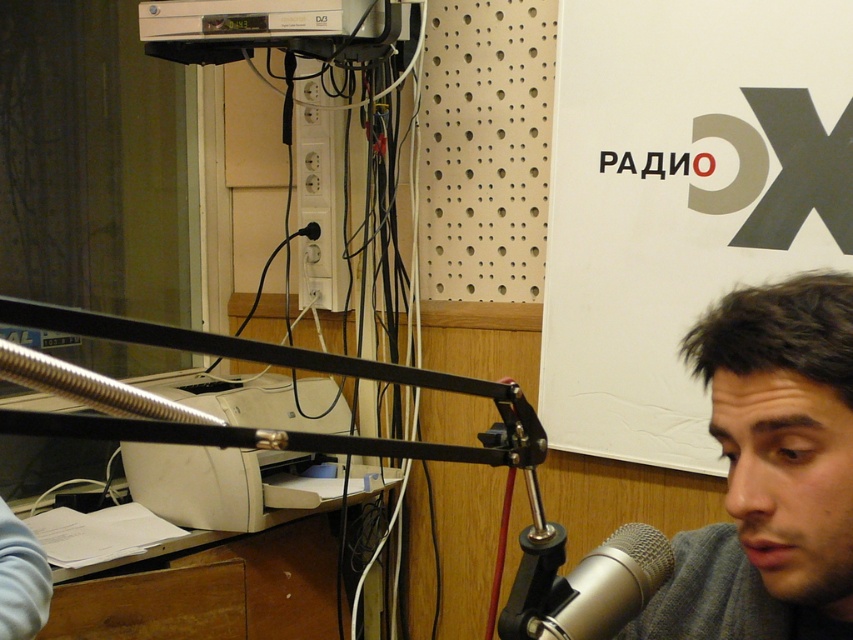
Question: Is gray fabric at lower right to the right of silver metallic microphone at center from the viewer's perspective?

Choices:
 (A) no
 (B) yes

Answer: (B)

Question: Can you confirm if white paperboard at upper center is smaller than gray fabric at lower right?

Choices:
 (A) no
 (B) yes

Answer: (A)

Question: Which point is closer to the camera?

Choices:
 (A) (550, 616)
 (B) (685, 554)
 (C) (659, 449)

Answer: (A)

Question: Which point is closer to the camera?

Choices:
 (A) gray fabric at lower right
 (B) white paperboard at upper center
 (C) silver metallic microphone at center

Answer: (A)

Question: Which point is farther from the camera taking this photo?

Choices:
 (A) (614, 624)
 (B) (729, 13)
 (C) (712, 344)

Answer: (B)

Question: Does white paperboard at upper center appear under gray fabric at lower right?

Choices:
 (A) yes
 (B) no

Answer: (B)